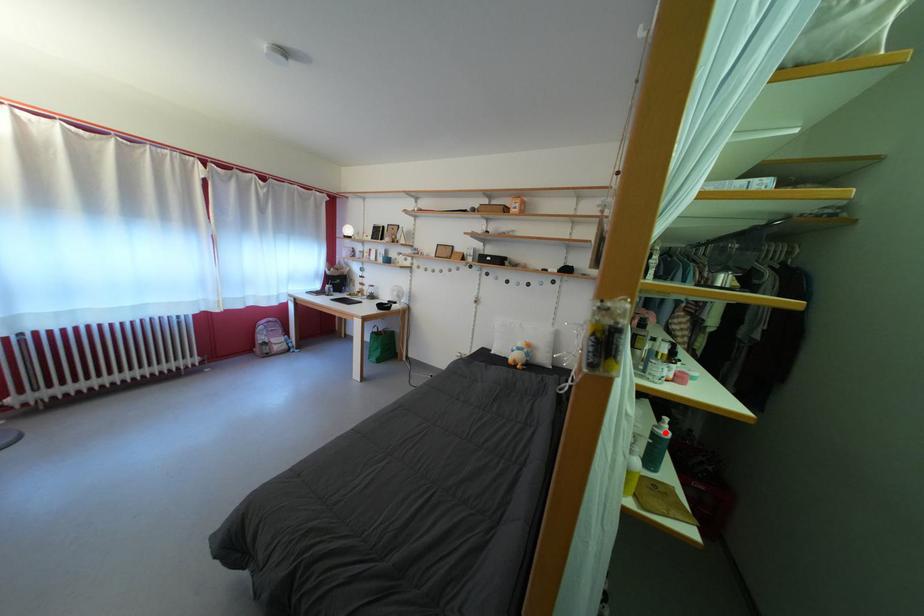
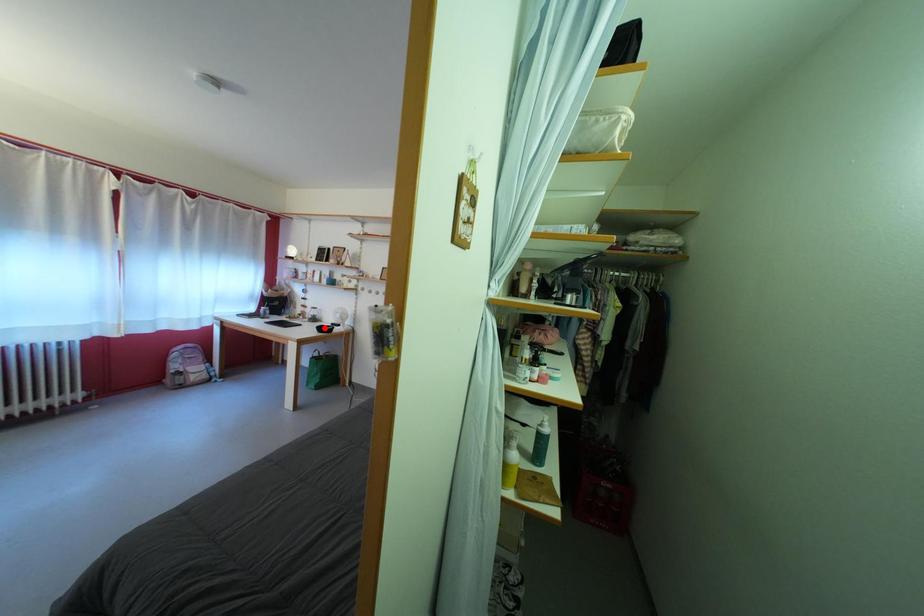
I am providing you with two images of the same scene from different viewpoints. A red point is marked on the first image and another point is marked on the second image. Do the highlighted points in image1 and image2 indicate the same real-world spot?

No